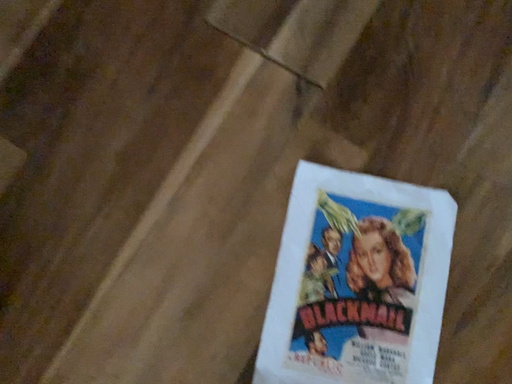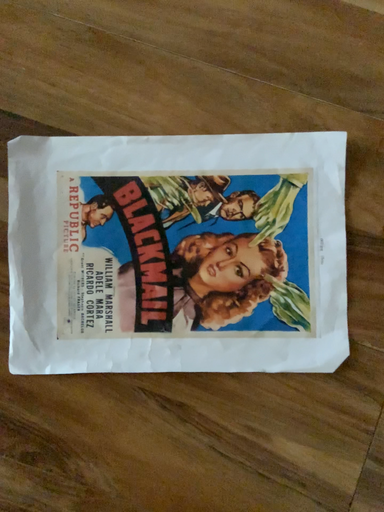
Question: Which way did the camera rotate in the video?

Choices:
 (A) rotated left
 (B) rotated right

Answer: (A)